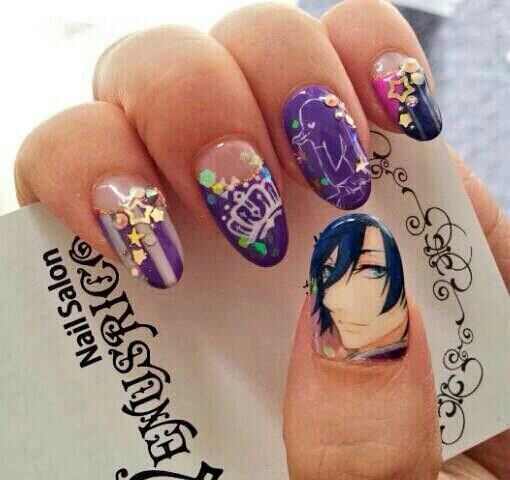
The height and width of the screenshot is (480, 510). In order to click on "nailsalon" in this screenshot , I will do `click(74, 306)`.